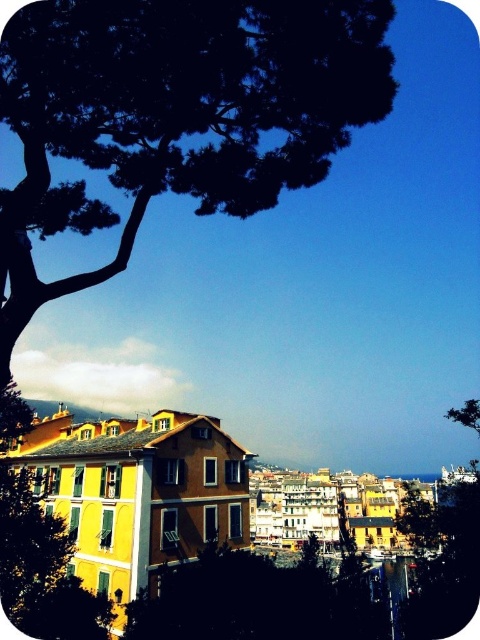
Question: Which point is farther to the camera?

Choices:
 (A) (260, 54)
 (B) (336, 637)

Answer: (B)

Question: Among these points, which one is farthest from the camera?

Choices:
 (A) (322, 600)
 (B) (245, 4)

Answer: (A)

Question: Does dark green textured tree at upper left have a greater width compared to green matte tree at upper left?

Choices:
 (A) yes
 (B) no

Answer: (A)

Question: Is dark green textured tree at upper left positioned at the back of green matte tree at upper left?

Choices:
 (A) yes
 (B) no

Answer: (B)

Question: Can you confirm if dark green textured tree at upper left is positioned below green matte tree at upper left?

Choices:
 (A) yes
 (B) no

Answer: (B)